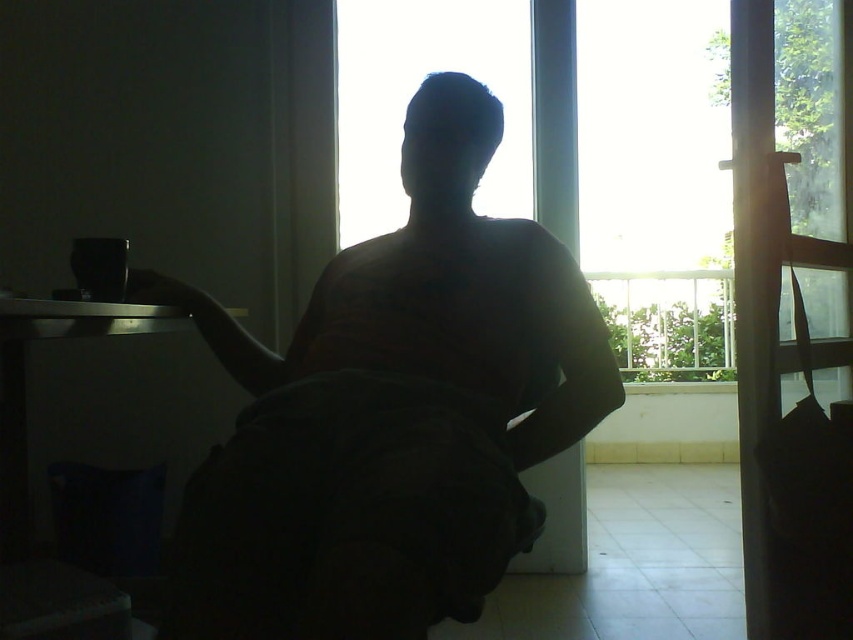
Between silhouette figure at center and transparent glass window at center, which one has more height?

With more height is transparent glass window at center.

Is silhouette figure at center behind transparent glass window at center?

No.

Between point (345, 253) and point (637, 248), which one is positioned in front?

Point (345, 253) is in front.

Where is `silhouette figure at center`? silhouette figure at center is located at coordinates (390, 412).